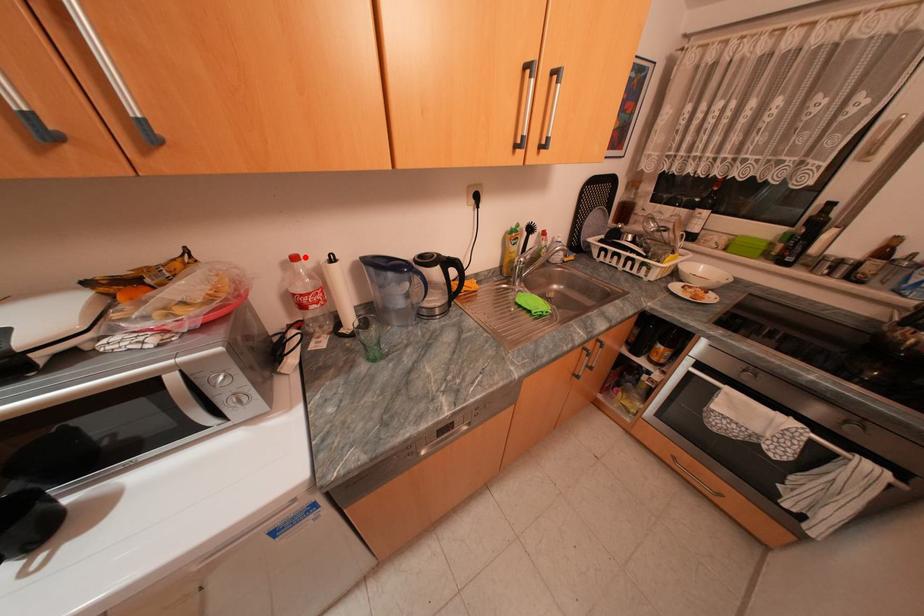
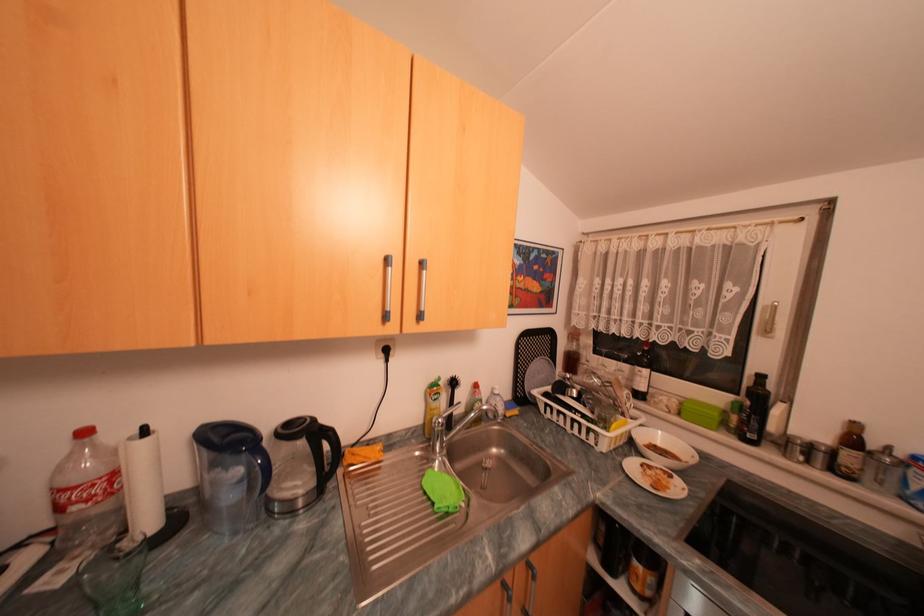
Where in the second image is the point corresponding to the highlighted location from the first image?

(94, 432)